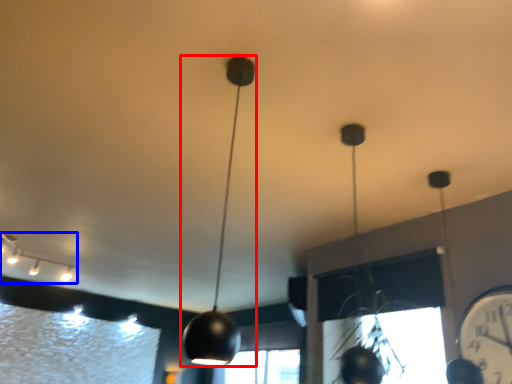
Question: Which object is closer to the camera taking this photo, lamp (highlighted by a red box) or lamp (highlighted by a blue box)?

Choices:
 (A) lamp
 (B) lamp

Answer: (A)